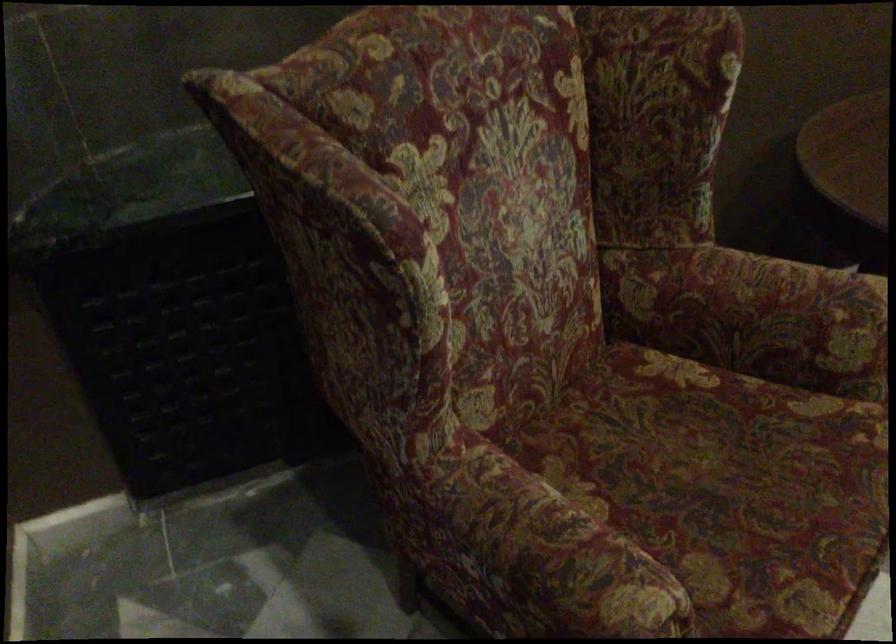
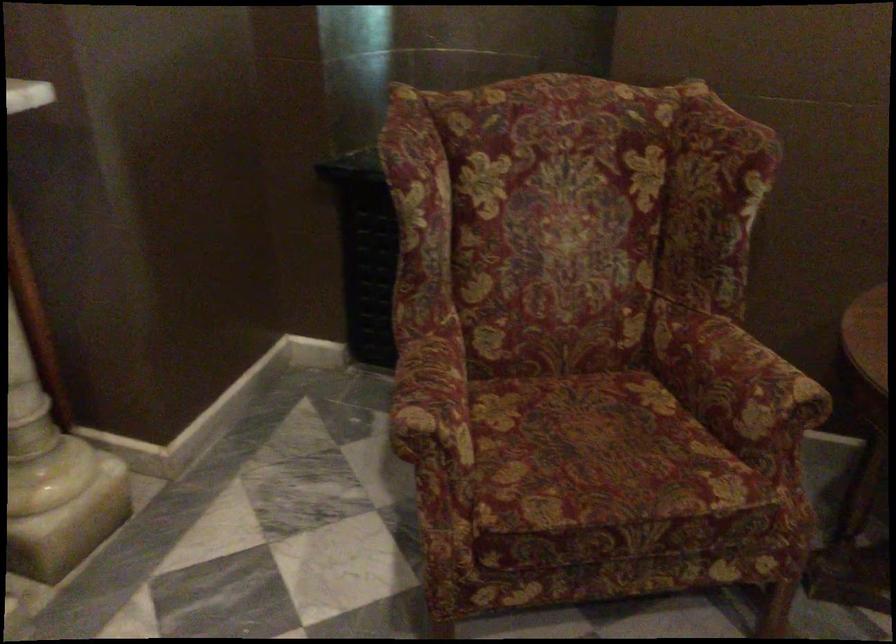
Question: Based on the continuous images, in which direction is the camera rotating? Reply with the corresponding letter.

Choices:
 (A) Left
 (B) Right
 (C) Up
 (D) Down

Answer: (A)